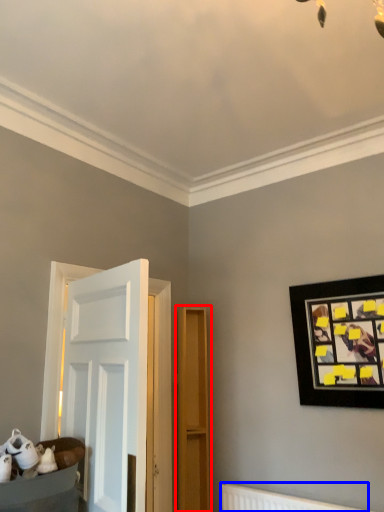
Question: Which of the following is the farthest to the observer, dresser (highlighted by a red box) or radiator (highlighted by a blue box)?

Choices:
 (A) dresser
 (B) radiator

Answer: (A)